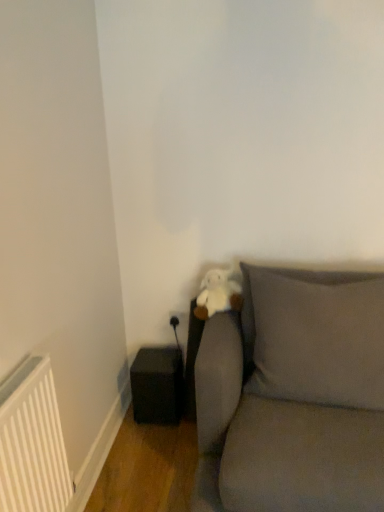
The width and height of the screenshot is (384, 512). Identify the location of free spot above white matte radiator at lower left (from a real-world perspective). (15, 364).